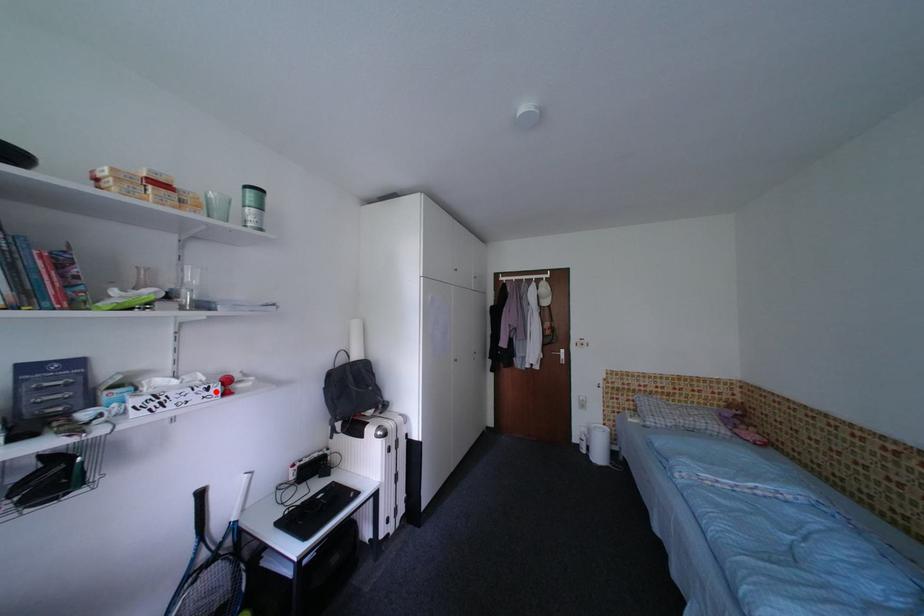
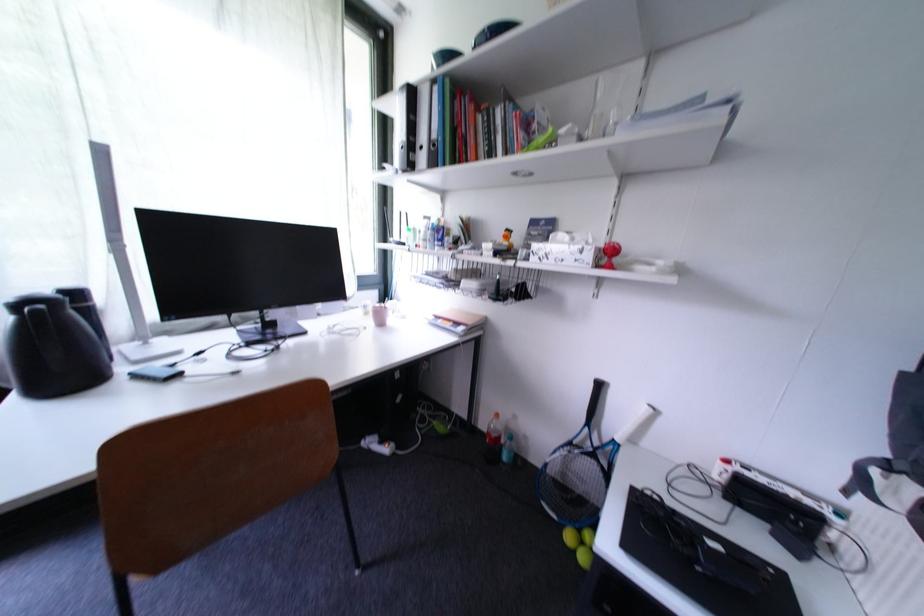
Where in the second image is the point corresponding to the highlighted location from the first image?

(590, 253)